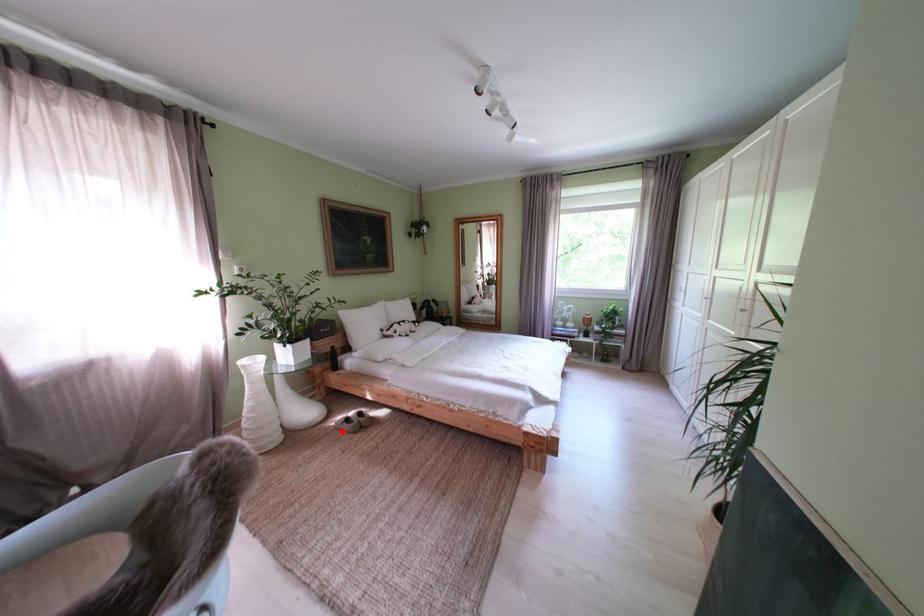
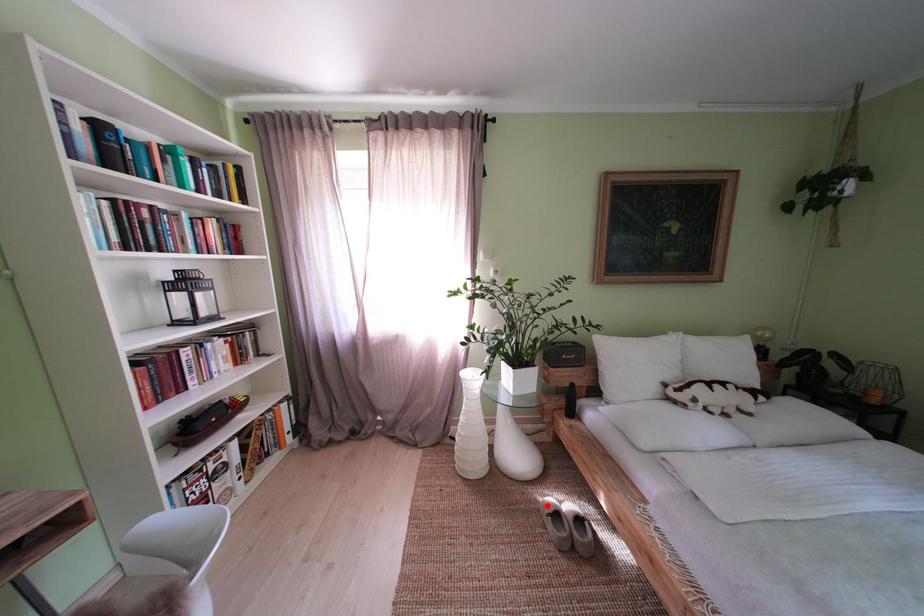
I am providing you with two images of the same scene from different viewpoints. A red point is marked on the first image and another point is marked on the second image. Is the marked point in image1 the same physical position as the marked point in image2?

Yes